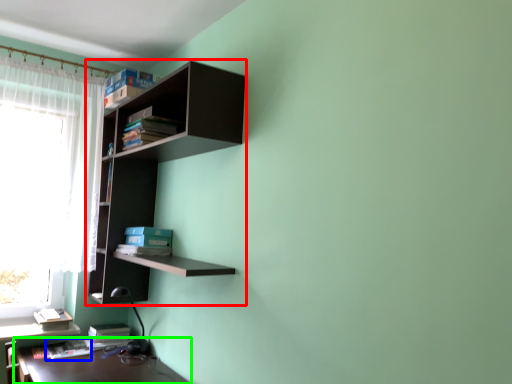
Question: Which object is positioned closest to shelf (highlighted by a red box)? Select from book (highlighted by a blue box) and table (highlighted by a green box).

Choices:
 (A) book
 (B) table

Answer: (B)